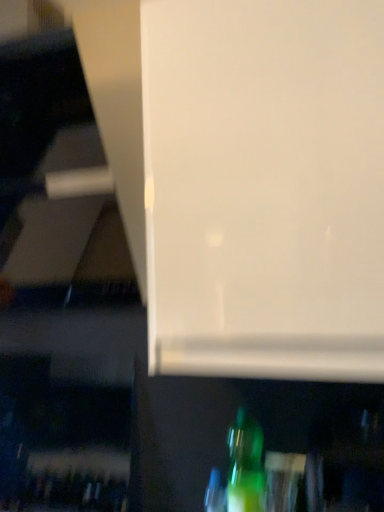
Question: From a real-world perspective, is translucent green bottle at lower center, which ranks as the 1th bottle in left-to-right order, positioned above or below green glass bottle at lower center, which is counted as the second bottle, starting from the left?

Choices:
 (A) above
 (B) below

Answer: (B)

Question: Is translucent green bottle at lower center, the 2th bottle when ordered from right to left, inside the boundaries of green glass bottle at lower center, which is counted as the second bottle, starting from the left, or outside?

Choices:
 (A) outside
 (B) inside

Answer: (A)

Question: Is translucent green bottle at lower center, the 2th bottle when ordered from right to left, wider or thinner than green glass bottle at lower center, the 1th bottle positioned from the right?

Choices:
 (A) wide
 (B) thin

Answer: (B)

Question: In the image, is green glass bottle at lower center, the 1th bottle positioned from the right, on the left side or the right side of translucent green bottle at lower center, the 2th bottle when ordered from right to left?

Choices:
 (A) left
 (B) right

Answer: (B)

Question: From a real-world perspective, is green glass bottle at lower center, which is counted as the second bottle, starting from the left, physically located above or below translucent green bottle at lower center, the 2th bottle when ordered from right to left?

Choices:
 (A) above
 (B) below

Answer: (A)

Question: Considering the positions of green glass bottle at lower center, the 1th bottle positioned from the right, and translucent green bottle at lower center, which ranks as the 1th bottle in left-to-right order, in the image, is green glass bottle at lower center, the 1th bottle positioned from the right, bigger or smaller than translucent green bottle at lower center, which ranks as the 1th bottle in left-to-right order,?

Choices:
 (A) small
 (B) big

Answer: (B)

Question: Is green glass bottle at lower center, which is counted as the second bottle, starting from the left, situated inside translucent green bottle at lower center, which ranks as the 1th bottle in left-to-right order, or outside?

Choices:
 (A) inside
 (B) outside

Answer: (B)